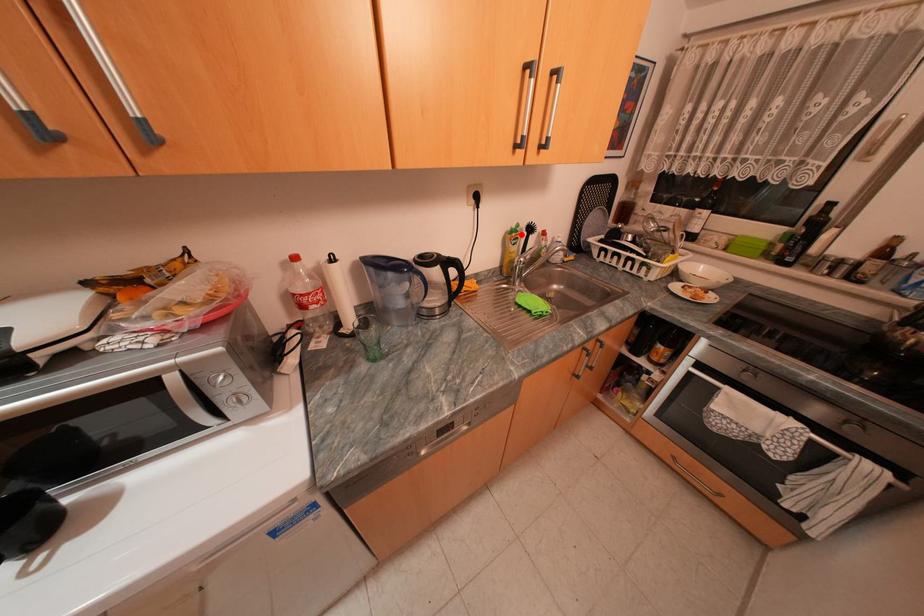
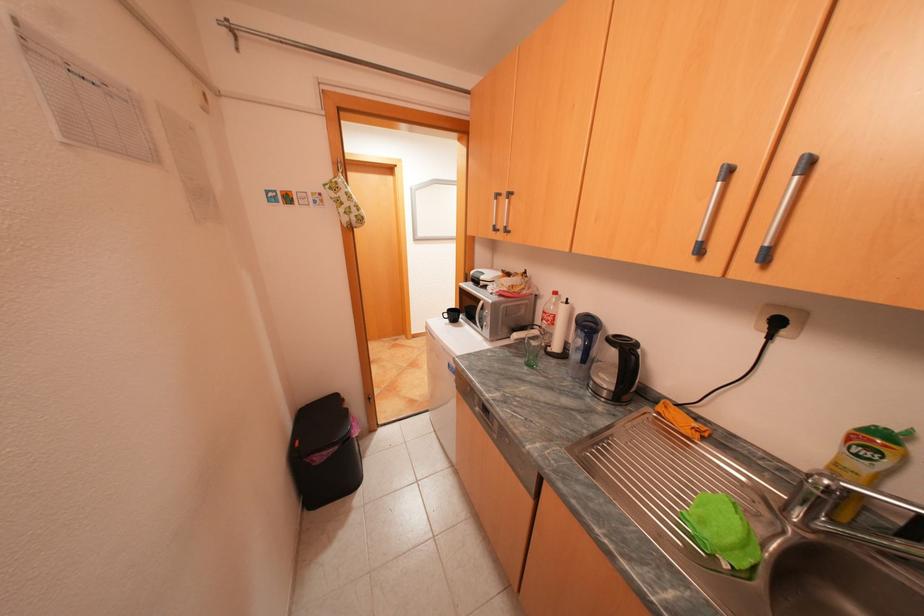
Locate, in the second image, the point that corresponds to the highlighted location in the first image.

(882, 439)